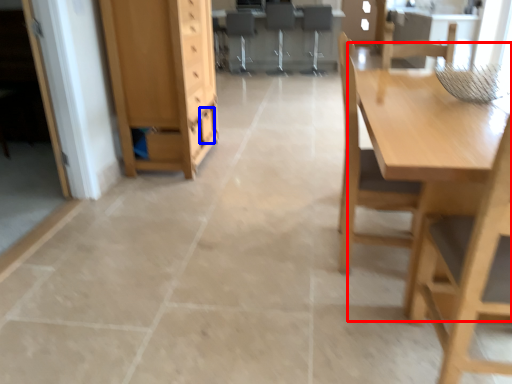
Question: Which point is closer to the camera, table (highlighted by a red box) or drawer (highlighted by a blue box)?

Choices:
 (A) table
 (B) drawer

Answer: (A)